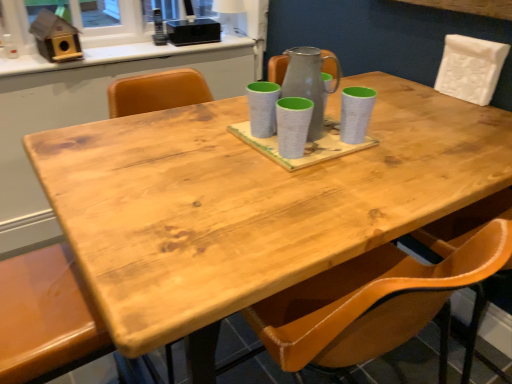
Question: Is white matte chair at upper right, which is the second chair in left-to-right order, bigger or smaller than matte brown chair at lower left, the 2th chair viewed from the top?

Choices:
 (A) big
 (B) small

Answer: (B)

Question: In the image, is white matte chair at upper right, acting as the 2th chair starting from the bottom, positioned in front of or behind matte brown chair at lower left, the 1th chair when ordered from left to right?

Choices:
 (A) front
 (B) behind

Answer: (B)

Question: Which object is positioned closest to the white glossy counter top at upper center?

Choices:
 (A) white matte chair at upper right, acting as the 2th chair starting from the bottom
 (B) speckled ceramic mug at center, acting as the third mug starting from the left
 (C) speckled white mug at center, the second mug viewed from the left
 (D) matte brown chair at lower left, the 1th chair when ordered from left to right
 (E) matte gray mug at center, the first mug in the left-to-right sequence

Answer: (E)

Question: Which object is the farthest from the speckled white mug at center, the second mug viewed from the left?

Choices:
 (A) speckled ceramic mug at center, arranged as the 1th mug when viewed from the right
 (B) matte brown chair at lower left, marked as the 2th chair in a right-to-left arrangement
 (C) matte gray mug at center, marked as the third mug in a right-to-left arrangement
 (D) matte gray pitcher at center
 (E) white matte chair at upper right, acting as the 2th chair starting from the bottom

Answer: (E)